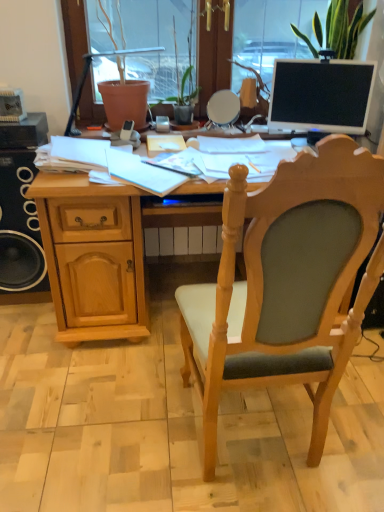
This screenshot has width=384, height=512. Find the location of `empty space that is to the right of satin silver phone at center, which ranks as the 2th mobile phone in bottom-to-top order`. empty space that is to the right of satin silver phone at center, which ranks as the 2th mobile phone in bottom-to-top order is located at coordinates (183, 128).